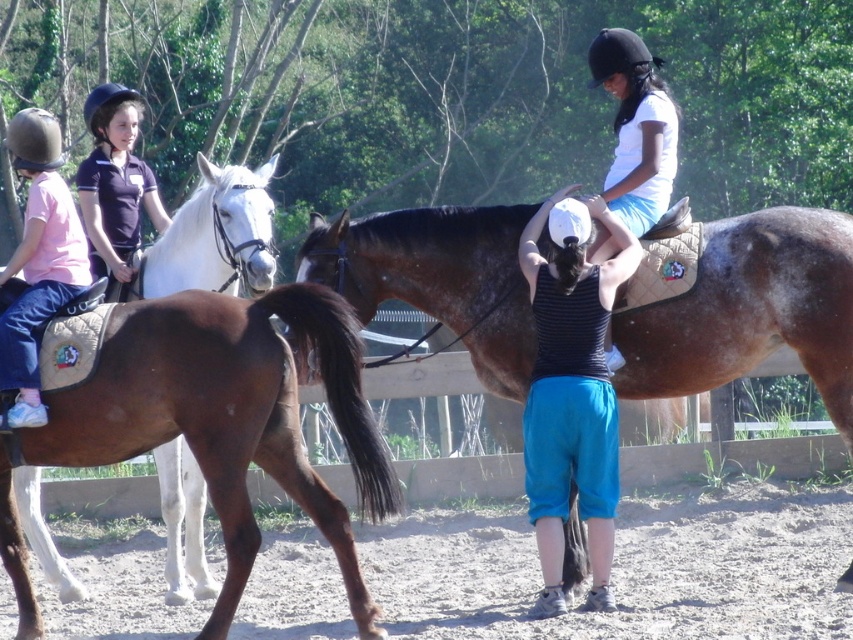
You are a photographer standing at the camera position. You want to take a closeup photo of the brown leather saddle at lower left. Can you estimate how far you need to walk forward to get closer to it?

The brown leather saddle at lower left is 6.86 meters away from the camera. To take a closeup photo, you need to walk forward 6.86 meters to reach it.

You are a photographer positioned at point 0.5, 0.5. You want to take a photo of the brown leather saddle at lower left located at point (229, 417). What direction should you move to get closer to the saddle?

You should move northeast to get closer to the brown leather saddle at lower left located at point (229, 417).